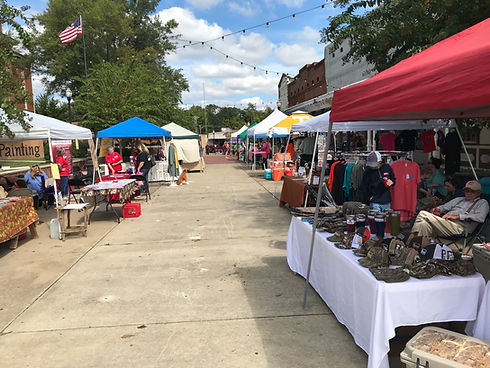
Identify the location of chairs. The image size is (490, 368). (77, 197).